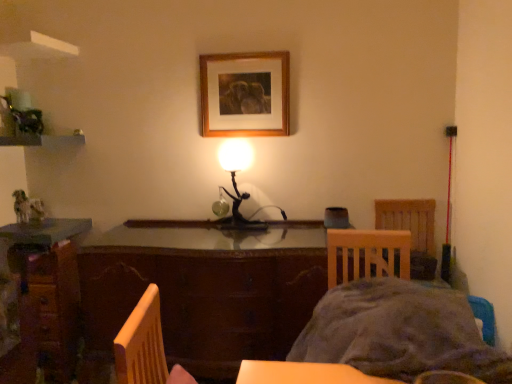
This screenshot has height=384, width=512. What do you see at coordinates (398, 332) in the screenshot?
I see `gray fabric bed at lower right` at bounding box center [398, 332].

What do you see at coordinates (412, 230) in the screenshot? This screenshot has width=512, height=384. I see `wooden chair at right` at bounding box center [412, 230].

Measure the distance between brown wooden table at center and camera.

6.17 feet.

Locate an element on the screen. The width and height of the screenshot is (512, 384). wooden picture frame at upper center is located at coordinates (245, 94).

What do you see at coordinates (245, 94) in the screenshot? The width and height of the screenshot is (512, 384). I see `wooden picture frame at upper center` at bounding box center [245, 94].

Locate an element on the screen. gray fabric bed at lower right is located at coordinates (398, 332).

Is metallic black lamp at center at the back of brown wooden table at center?

brown wooden table at center is not turned away from metallic black lamp at center.

Where is `table below the metallic black lamp at center (from the image's perspective)`? The image size is (512, 384). table below the metallic black lamp at center (from the image's perspective) is located at coordinates (206, 291).

Which of these two, brown wooden table at center or metallic black lamp at center, is wider?

brown wooden table at center is wider.

Which point is more forward, (87, 268) or (250, 150)?

The point (87, 268) is more forward.

In the scene shown: From a real-world perspective, which object rests below the other?

In real-world perspective, gray fabric bed at lower right is lower.

Between gray fabric bed at lower right and wooden chair at right, which one is positioned behind?

wooden chair at right is further from the camera.

Would you say wooden chair at right is part of gray fabric bed at lower right's contents?

No, wooden chair at right is not inside gray fabric bed at lower right.

Which of these two, gray fabric bed at lower right or wooden chair at right, is thinner?

gray fabric bed at lower right.

Image resolution: width=512 pixels, height=384 pixels. What are the coordinates of `desk on the left of brown wooden table at center` in the screenshot? It's located at (48, 294).

Does wooden desk at lower left have a larger size compared to brown wooden table at center?

No, wooden desk at lower left is not bigger than brown wooden table at center.

Is wooden desk at lower left positioned with its back to brown wooden table at center?

No, wooden desk at lower left is not facing the opposite direction of brown wooden table at center.

Is gray fabric bed at lower right in front of or behind wooden desk at lower left in the image?

Visually, gray fabric bed at lower right is located in front of wooden desk at lower left.

In the scene shown: From the image's perspective, which one is positioned lower, gray fabric bed at lower right or wooden desk at lower left?

wooden desk at lower left appears lower in the image.

Identify the location of bed on the right of wooden desk at lower left. The image size is (512, 384). (398, 332).

Considering the positions of objects gray fabric bed at lower right and wooden desk at lower left in the image provided, who is more to the right, gray fabric bed at lower right or wooden desk at lower left?

Positioned to the right is gray fabric bed at lower right.

Between point (226, 160) and point (7, 260), which one is positioned in front?

The point (7, 260) is closer to the camera.

From the picture: Does metallic black lamp at center have a lesser height compared to wooden desk at lower left?

Yes, metallic black lamp at center is shorter than wooden desk at lower left.

From a real-world perspective, between metallic black lamp at center and wooden desk at lower left, who is vertically lower?

In real-world perspective, wooden desk at lower left is lower.

In order to click on desk lying on the left of metallic black lamp at center in this screenshot , I will do `click(48, 294)`.

Does wooden chair at right have a smaller size compared to wooden picture frame at upper center?

Actually, wooden chair at right might be larger than wooden picture frame at upper center.

Considering the positions of objects wooden chair at right and wooden picture frame at upper center in the image provided, who is more to the right, wooden chair at right or wooden picture frame at upper center?

Positioned to the right is wooden chair at right.

I want to click on picture frame on the left of wooden chair at right, so click(245, 94).

Is wooden desk at lower left at the back of brown wooden table at center?

No, brown wooden table at center is not facing the opposite direction of wooden desk at lower left.

Is the depth of brown wooden table at center greater than that of wooden desk at lower left?

No.

You are a GUI agent. You are given a task and a screenshot of the screen. Output one action in this format:
    pyautogui.click(x=<x>, y=<y>)
    Task: Click on the table in front of the wooden desk at lower left
    
    Given the screenshot: What is the action you would take?
    pyautogui.click(x=206, y=291)

Image resolution: width=512 pixels, height=384 pixels. I want to click on lamp above the brown wooden table at center (from the image's perspective), so click(x=236, y=184).

Locate an element on the screen. Image resolution: width=512 pixels, height=384 pixels. bed that appears below the wooden chair at right (from a real-world perspective) is located at coordinates (398, 332).

Looking at the image, which one is located further to metallic black lamp at center, wooden desk at lower left or brown wooden table at center?

wooden desk at lower left is further to metallic black lamp at center.

Considering their positions, is wooden picture frame at upper center positioned further to brown wooden table at center than wooden desk at lower left?

Based on the image, wooden picture frame at upper center appears to be further to brown wooden table at center.

Based on their spatial positions, is gray fabric bed at lower right or wooden picture frame at upper center further from metallic black lamp at center?

gray fabric bed at lower right.

Looking at the image, which one is located further to wooden chair at right, wooden desk at lower left or wooden picture frame at upper center?

The object further to wooden chair at right is wooden desk at lower left.

Which object lies further to the anchor point metallic black lamp at center, brown wooden table at center or wooden chair at right?

wooden chair at right is positioned further to the anchor metallic black lamp at center.

When comparing their distances from metallic black lamp at center, does wooden desk at lower left or wooden chair at right seem further?

wooden desk at lower left lies further to metallic black lamp at center than the other object.

Considering their positions, is brown wooden table at center positioned further to metallic black lamp at center than wooden picture frame at upper center?

Among the two, brown wooden table at center is located further to metallic black lamp at center.

Looking at the image, which one is located further to wooden desk at lower left, metallic black lamp at center or brown wooden table at center?

The object further to wooden desk at lower left is metallic black lamp at center.

You are a GUI agent. You are given a task and a screenshot of the screen. Output one action in this format:
    pyautogui.click(x=<x>, y=<y>)
    Task: Click on the chair that lies between wooden picture frame at upper center and brown wooden table at center from top to bottom
    The width and height of the screenshot is (512, 384).
    Given the screenshot: What is the action you would take?
    pyautogui.click(x=412, y=230)

In order to click on lamp situated between brown wooden table at center and wooden chair at right from left to right in this screenshot , I will do `click(236, 184)`.

Where is `picture frame between wooden desk at lower left and gray fabric bed at lower right in the horizontal direction`? The image size is (512, 384). picture frame between wooden desk at lower left and gray fabric bed at lower right in the horizontal direction is located at coordinates point(245,94).

The width and height of the screenshot is (512, 384). Find the location of `table between wooden desk at lower left and wooden chair at right from left to right`. table between wooden desk at lower left and wooden chair at right from left to right is located at coordinates (206, 291).